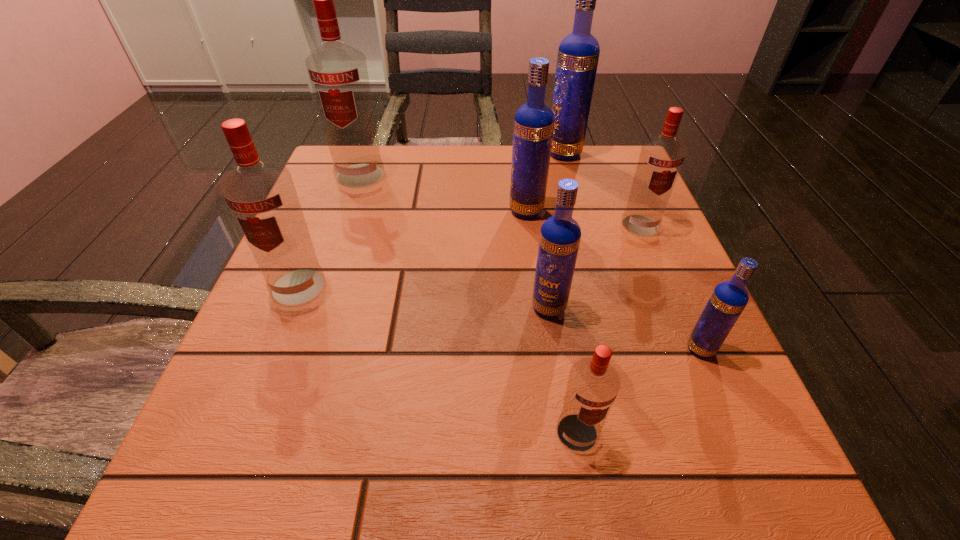
The height and width of the screenshot is (540, 960). What are the coordinates of `vacant space in between the second biggest red vodka and the second farthest red vodka` in the screenshot? It's located at (469, 256).

Image resolution: width=960 pixels, height=540 pixels. Identify the location of free area in between the second nearest blue vodka and the second biggest red vodka. (423, 297).

Find the location of a particular element. empty location between the smallest red vodka and the farthest red vodka is located at coordinates tap(468, 304).

You are a GUI agent. You are given a task and a screenshot of the screen. Output one action in this format:
    pyautogui.click(x=<x>, y=<y>)
    Task: Click on the vacant point located between the seventh nearest object and the second smallest red vodka
    
    Given the screenshot: What is the action you would take?
    pyautogui.click(x=500, y=200)

Locate an element on the screen. The height and width of the screenshot is (540, 960). unoccupied area between the second farthest red vodka and the second smallest blue vodka is located at coordinates (594, 266).

This screenshot has width=960, height=540. What are the coordinates of `free point between the third nearest red vodka and the second biggest blue vodka` in the screenshot? It's located at tap(583, 218).

I want to click on free space between the seventh nearest vodka and the third biggest blue vodka, so click(x=454, y=241).

Locate an element on the screen. This screenshot has width=960, height=540. empty space that is in between the rightmost blue vodka and the second biggest blue vodka is located at coordinates pyautogui.click(x=613, y=280).

I want to click on vacant space that is in between the third smallest red vodka and the second farthest vodka, so pyautogui.click(x=329, y=231).

Locate an element on the screen. This screenshot has width=960, height=540. the sixth closest object relative to the farthest vodka is located at coordinates (262, 197).